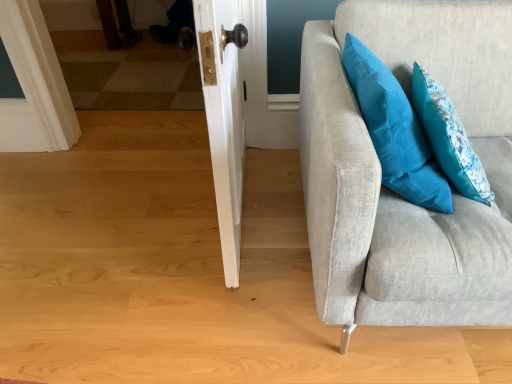
Find the location of a particular element. The width and height of the screenshot is (512, 384). teal fabric pillow at upper right, placed as the 1th pillow when sorted from right to left is located at coordinates (449, 137).

Describe the element at coordinates (449, 137) in the screenshot. The height and width of the screenshot is (384, 512). I see `teal fabric pillow at upper right, placed as the 1th pillow when sorted from right to left` at that location.

What is the approximate width of teal fabric pillow at upper right, positioned as the 2th pillow in right-to-left order?

teal fabric pillow at upper right, positioned as the 2th pillow in right-to-left order, is 23.95 centimeters wide.

Where is `light gray fabric couch at right`? This screenshot has height=384, width=512. light gray fabric couch at right is located at coordinates (389, 190).

Locate an element on the screen. The width and height of the screenshot is (512, 384). teal fabric pillow at upper right, which is counted as the 2th pillow, starting from the left is located at coordinates (449, 137).

Which is in front, teal fabric pillow at upper right, placed as the 1th pillow when sorted from right to left, or teal fabric pillow at upper right, positioned as the 2th pillow in right-to-left order?

teal fabric pillow at upper right, positioned as the 2th pillow in right-to-left order, is closer to the camera.

Can you confirm if teal fabric pillow at upper right, which is counted as the 2th pillow, starting from the left, is taller than teal fabric pillow at upper right, positioned as the 2th pillow in right-to-left order?

No.

At what (x,y) coordinates should I click in order to perform the action: click on pillow that is under the teal fabric pillow at upper right, positioned as the 2th pillow in right-to-left order (from a real-world perspective). Please return your answer as a coordinate pair (x, y). Image resolution: width=512 pixels, height=384 pixels. Looking at the image, I should click on tap(449, 137).

Consider the image. From a real-world perspective, is teal fabric pillow at upper right, placed as the 1th pillow when sorted from right to left, above or below teal fabric pillow at upper right, positioned as the 2th pillow in right-to-left order?

From a real-world perspective, teal fabric pillow at upper right, placed as the 1th pillow when sorted from right to left, is physically below teal fabric pillow at upper right, positioned as the 2th pillow in right-to-left order.

From the image's perspective, is teal fabric pillow at upper right, the 1th pillow when ordered from left to right, above or below light gray fabric couch at right?

Clearly, from the image's perspective, teal fabric pillow at upper right, the 1th pillow when ordered from left to right, is above light gray fabric couch at right.

Considering the relative sizes of teal fabric pillow at upper right, positioned as the 2th pillow in right-to-left order, and light gray fabric couch at right in the image provided, is teal fabric pillow at upper right, positioned as the 2th pillow in right-to-left order, bigger than light gray fabric couch at right?

No, teal fabric pillow at upper right, positioned as the 2th pillow in right-to-left order, is not bigger than light gray fabric couch at right.

Is teal fabric pillow at upper right, positioned as the 2th pillow in right-to-left order, inside or outside of light gray fabric couch at right?

teal fabric pillow at upper right, positioned as the 2th pillow in right-to-left order, fits inside light gray fabric couch at right.

Considering the points (394, 77) and (356, 5), which point is behind, point (394, 77) or point (356, 5)?

The point (356, 5) is behind.

Which is more to the right, light gray fabric couch at right or teal fabric pillow at upper right, placed as the 1th pillow when sorted from right to left?

light gray fabric couch at right is more to the right.

Between light gray fabric couch at right and teal fabric pillow at upper right, placed as the 1th pillow when sorted from right to left, which one has less height?

teal fabric pillow at upper right, placed as the 1th pillow when sorted from right to left.

Between point (328, 93) and point (458, 117), which one is positioned in front?

Point (328, 93)

Looking at this image, how different are the orientations of light gray fabric couch at right and teal fabric pillow at upper right, which is counted as the 2th pillow, starting from the left, in degrees?

89.7 degrees.

Is light gray fabric couch at right beside teal fabric pillow at upper right, positioned as the 2th pillow in right-to-left order?

No, light gray fabric couch at right is not with teal fabric pillow at upper right, positioned as the 2th pillow in right-to-left order.

From the image's perspective, relative to teal fabric pillow at upper right, the 1th pillow when ordered from left to right, is light gray fabric couch at right above or below?

From the image's perspective, light gray fabric couch at right appears below teal fabric pillow at upper right, the 1th pillow when ordered from left to right.

Identify the location of studio couch below the teal fabric pillow at upper right, the 1th pillow when ordered from left to right (from a real-world perspective). This screenshot has width=512, height=384. (389, 190).

Considering the positions of objects light gray fabric couch at right and teal fabric pillow at upper right, positioned as the 2th pillow in right-to-left order, in the image provided, who is more to the left, light gray fabric couch at right or teal fabric pillow at upper right, positioned as the 2th pillow in right-to-left order,?

Positioned to the left is teal fabric pillow at upper right, positioned as the 2th pillow in right-to-left order.

Which is farther, (x=398, y=153) or (x=420, y=78)?

Point (x=420, y=78)

Is teal fabric pillow at upper right, positioned as the 2th pillow in right-to-left order, further to the viewer compared to teal fabric pillow at upper right, which is counted as the 2th pillow, starting from the left?

No, it is in front of teal fabric pillow at upper right, which is counted as the 2th pillow, starting from the left.

How far apart are teal fabric pillow at upper right, positioned as the 2th pillow in right-to-left order, and teal fabric pillow at upper right, placed as the 1th pillow when sorted from right to left?

They are 4.26 inches apart.

Is teal fabric pillow at upper right, the 1th pillow when ordered from left to right, looking in the opposite direction of teal fabric pillow at upper right, placed as the 1th pillow when sorted from right to left?

Yes.

Which is behind, teal fabric pillow at upper right, placed as the 1th pillow when sorted from right to left, or light gray fabric couch at right?

Positioned behind is teal fabric pillow at upper right, placed as the 1th pillow when sorted from right to left.

Is light gray fabric couch at right at the back of teal fabric pillow at upper right, placed as the 1th pillow when sorted from right to left?

That's right, teal fabric pillow at upper right, placed as the 1th pillow when sorted from right to left, is facing away from light gray fabric couch at right.

Which point is more forward, [473,174] or [436,252]?

The point [436,252] is in front.

The image size is (512, 384). What are the coordinates of `pillow on the right of teal fabric pillow at upper right, the 1th pillow when ordered from left to right` in the screenshot? It's located at (449, 137).

The image size is (512, 384). Identify the location of studio couch that is in front of the teal fabric pillow at upper right, positioned as the 2th pillow in right-to-left order. (389, 190).

From the image, which object appears to be farther from light gray fabric couch at right, teal fabric pillow at upper right, positioned as the 2th pillow in right-to-left order, or teal fabric pillow at upper right, which is counted as the 2th pillow, starting from the left?

teal fabric pillow at upper right, which is counted as the 2th pillow, starting from the left, lies further to light gray fabric couch at right than the other object.

Based on their spatial positions, is teal fabric pillow at upper right, the 1th pillow when ordered from left to right, or light gray fabric couch at right further from teal fabric pillow at upper right, placed as the 1th pillow when sorted from right to left?

light gray fabric couch at right is positioned further to the anchor teal fabric pillow at upper right, placed as the 1th pillow when sorted from right to left.

From the image, which object appears to be farther from teal fabric pillow at upper right, positioned as the 2th pillow in right-to-left order, teal fabric pillow at upper right, placed as the 1th pillow when sorted from right to left, or light gray fabric couch at right?

Based on the image, light gray fabric couch at right appears to be further to teal fabric pillow at upper right, positioned as the 2th pillow in right-to-left order.

Which object lies further to the anchor point teal fabric pillow at upper right, the 1th pillow when ordered from left to right, light gray fabric couch at right or teal fabric pillow at upper right, placed as the 1th pillow when sorted from right to left?

Among the two, light gray fabric couch at right is located further to teal fabric pillow at upper right, the 1th pillow when ordered from left to right.

Which object lies nearer to the anchor point teal fabric pillow at upper right, which is counted as the 2th pillow, starting from the left, light gray fabric couch at right or teal fabric pillow at upper right, the 1th pillow when ordered from left to right?

teal fabric pillow at upper right, the 1th pillow when ordered from left to right, is closer to teal fabric pillow at upper right, which is counted as the 2th pillow, starting from the left.

Based on their spatial positions, is teal fabric pillow at upper right, which is counted as the 2th pillow, starting from the left, or teal fabric pillow at upper right, the 1th pillow when ordered from left to right, further from light gray fabric couch at right?

Based on the image, teal fabric pillow at upper right, which is counted as the 2th pillow, starting from the left, appears to be further to light gray fabric couch at right.

In order to click on pillow between light gray fabric couch at right and teal fabric pillow at upper right, placed as the 1th pillow when sorted from right to left, from front to back in this screenshot , I will do `click(395, 131)`.